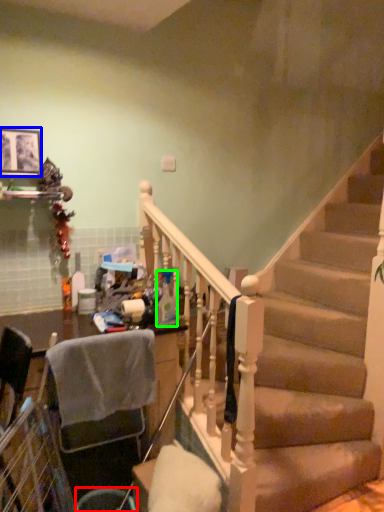
Question: Based on their relative distances, which object is nearer to trash bin/can (highlighted by a red box)? Choose from picture frame (highlighted by a blue box) and bottle (highlighted by a green box).

Choices:
 (A) picture frame
 (B) bottle

Answer: (B)